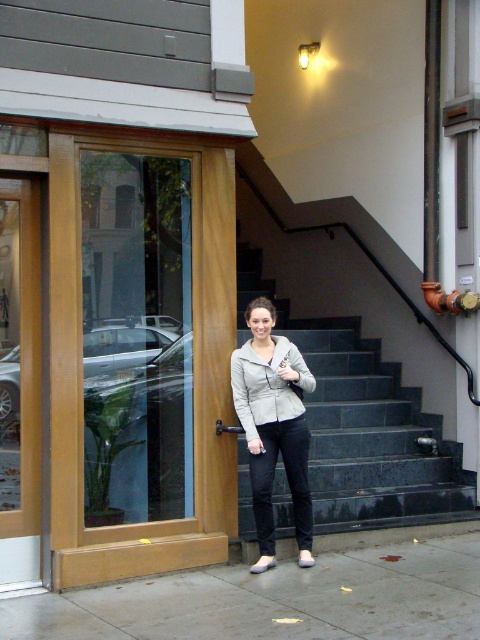
You are a photographer adjusting your camera settings to capture the scene. You notice two points in the image at coordinates point (142,461) and point (275,403). Which point is closer to the camera lens?

Point (142,461) is further to the camera than point (275,403), so the point closer to the camera lens is point (142,461).

You are a delivery person trying to see the address on the building. You have to choose between looking through the clear glass door at left or the gray matte jacket at center. Which object would allow you to see the address better?

The clear glass door at left is bigger than the gray matte jacket at center, so the clear glass door at left would allow you to see the address better because it is larger and more reflective, providing a clearer view of the street scene behind it.

You are a delivery person trying to deliver a package to the building entrance. You see the dark gray stone stairs at center and the gray matte jacket at center. Which object is bigger and would block your path more if you approach the entrance?

The dark gray stone stairs at center is larger in size than the gray matte jacket at center, so it would block your path more if you approach the entrance.